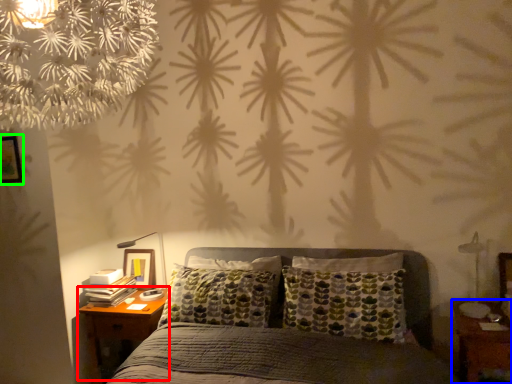
Question: Which object is the farthest from nightstand (highlighted by a red box)? Choose among these: nightstand (highlighted by a blue box) or picture frame (highlighted by a green box).

Choices:
 (A) nightstand
 (B) picture frame

Answer: (A)